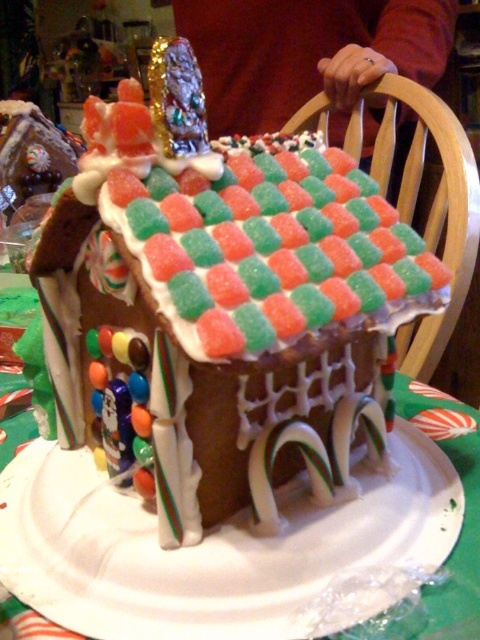
Question: Is candy-coated gingerbread house at center to the left of white paper plate at center from the viewer's perspective?

Choices:
 (A) no
 (B) yes

Answer: (B)

Question: Among these points, which one is farthest from the camera?

Choices:
 (A) (186, 563)
 (B) (111, 216)

Answer: (A)

Question: Observing the image, what is the correct spatial positioning of candy-coated gingerbread house at center in reference to white paper plate at center?

Choices:
 (A) left
 (B) right

Answer: (A)

Question: Does candy-coated gingerbread house at center appear over white paper plate at center?

Choices:
 (A) no
 (B) yes

Answer: (B)